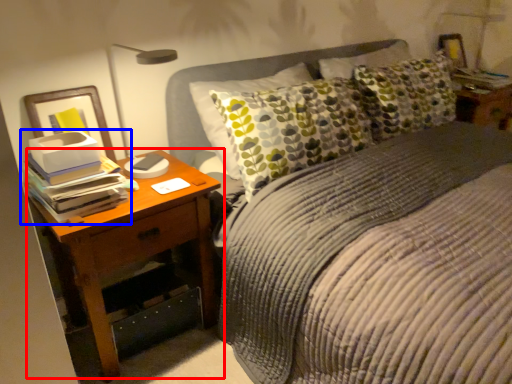
Question: Among these objects, which one is nearest to the camera, nightstand (highlighted by a red box) or book (highlighted by a blue box)?

Choices:
 (A) nightstand
 (B) book

Answer: (B)